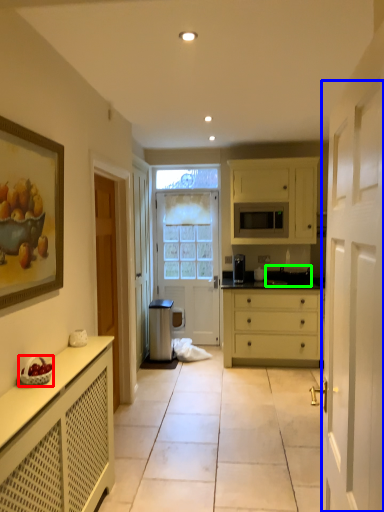
Question: Which object is positioned farthest from fruit dish (highlighted by a red box)? Select from screen door (highlighted by a blue box) and sink (highlighted by a green box).

Choices:
 (A) screen door
 (B) sink

Answer: (B)